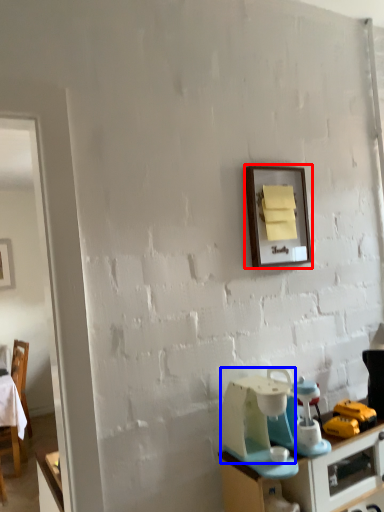
Question: Which object appears farthest to the camera in this image, picture frame (highlighted by a red box) or appliance (highlighted by a blue box)?

Choices:
 (A) picture frame
 (B) appliance

Answer: (A)